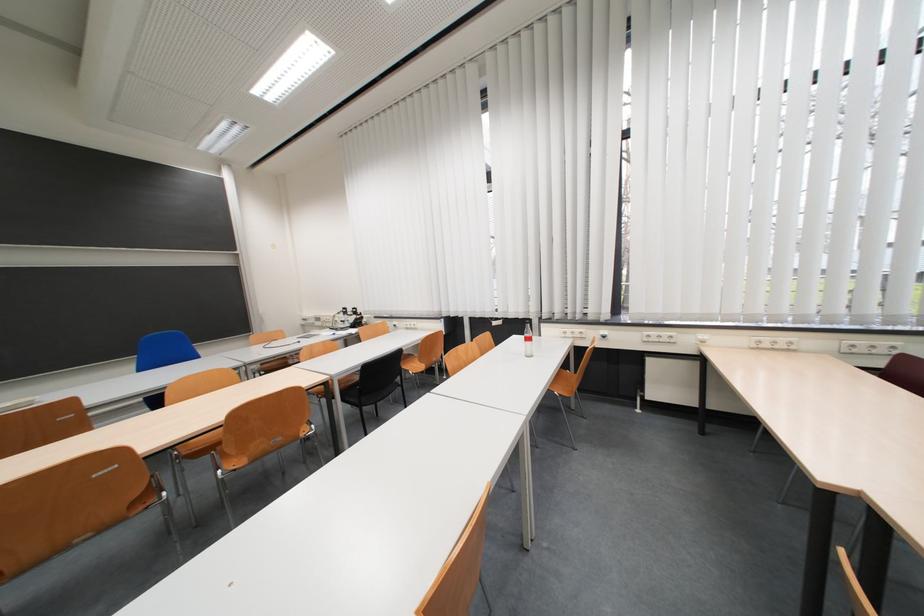
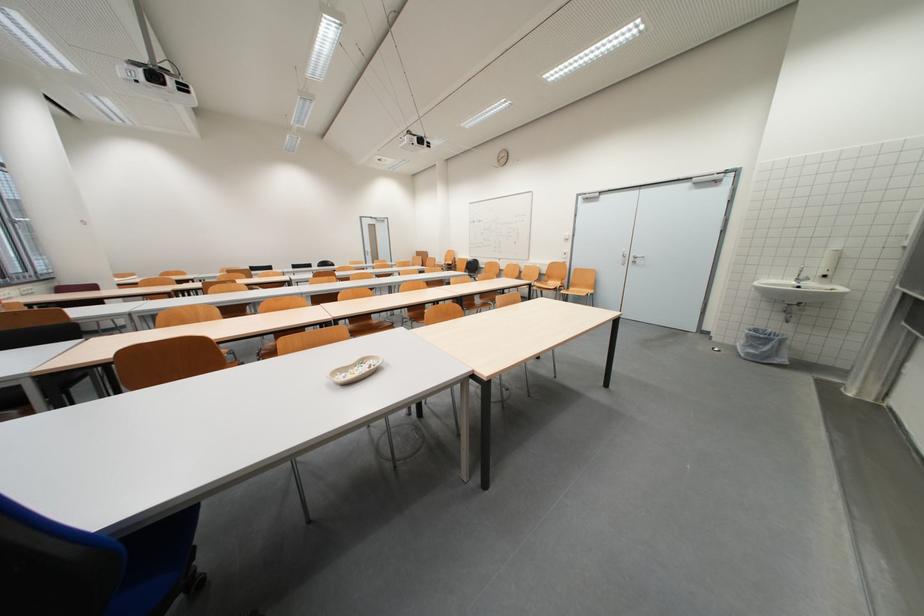
Question: I am providing you with two images of the same scene from different viewpoints. Please identify which objects are invisible in image2.

Choices:
 (A) wooden chair sitting surface
 (B) floral pillow
 (C) blue chair sitting surface
 (D) small ceramic dish

Answer: (C)